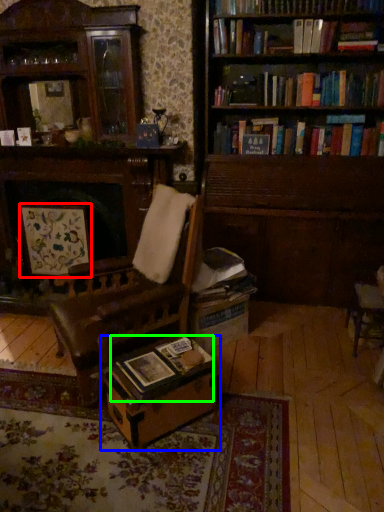
Question: Which is farther away from picture frame (highlighted by a red box)? table (highlighted by a blue box) or book (highlighted by a green box)?

Choices:
 (A) table
 (B) book

Answer: (A)